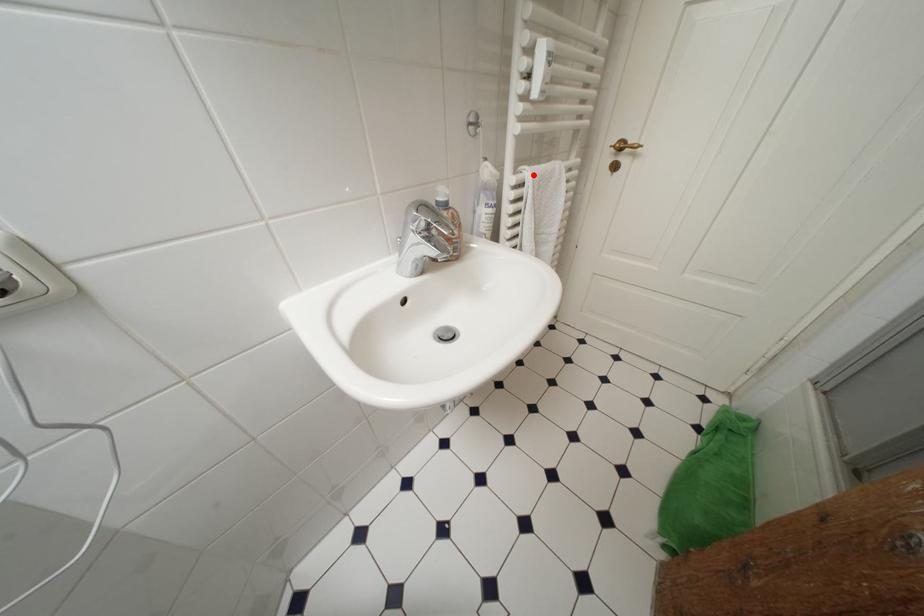
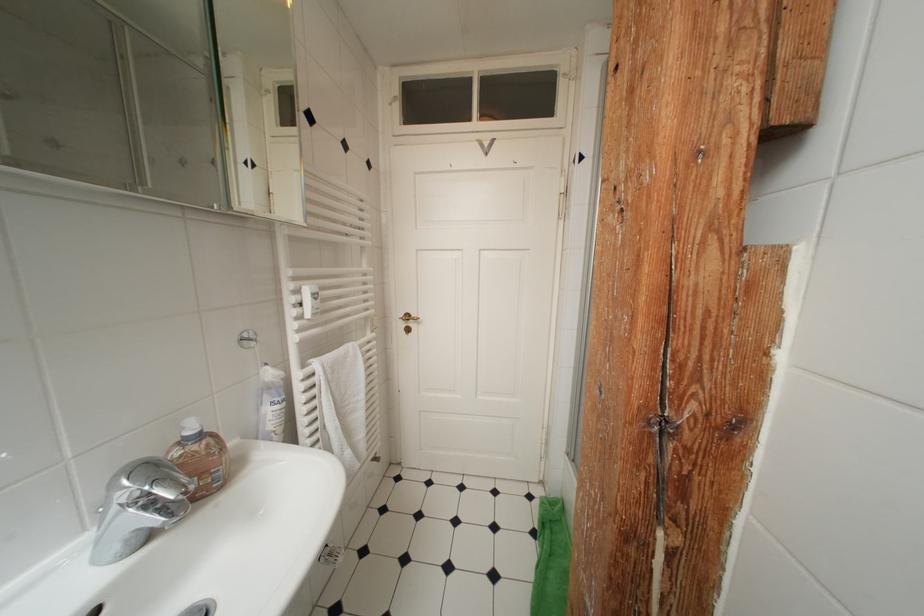
Where in the second image is the point corresponding to the highlighted location from the first image?

(322, 368)